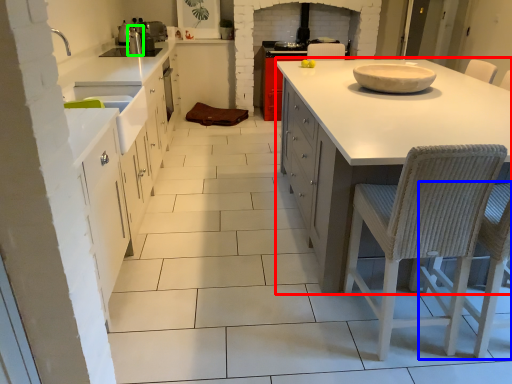
Question: Considering the real-world distances, which object is closest to countertop (highlighted by a red box)? chair (highlighted by a blue box) or appliance (highlighted by a green box).

Choices:
 (A) chair
 (B) appliance

Answer: (A)